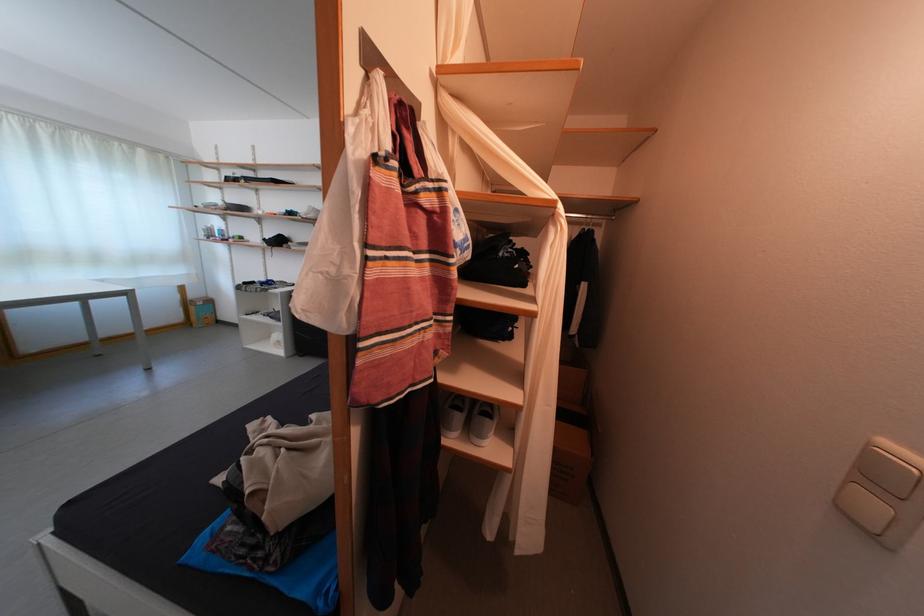
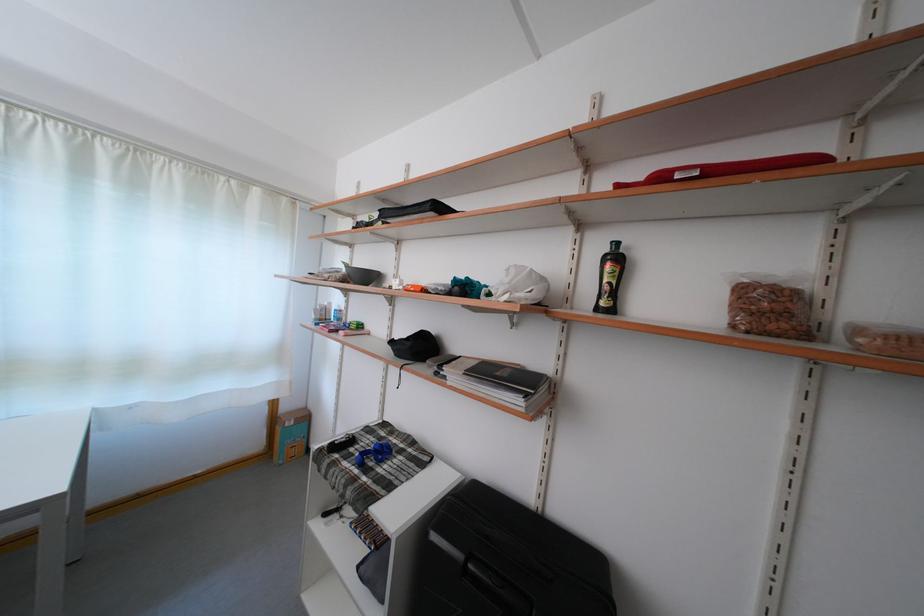
What movement of the cameraman would produce the second image?

The movement direction of the cameraman is left, forward.